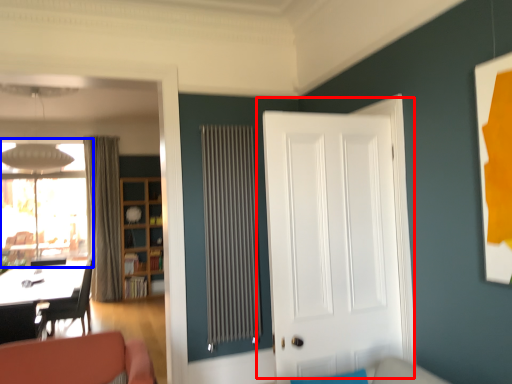
Question: Which object appears closest to the camera in this image, door (highlighted by a red box) or window (highlighted by a blue box)?

Choices:
 (A) door
 (B) window

Answer: (A)